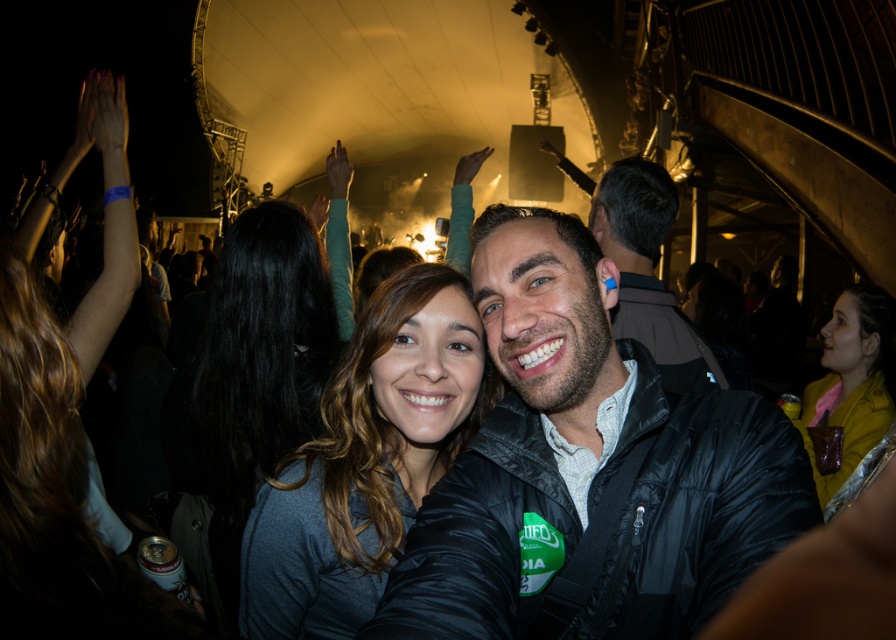
Does dark gray sweater at center come in front of yellow leather jacket at center?

No.

Between dark gray sweater at center and yellow leather jacket at center, which one is positioned higher?

dark gray sweater at center is above.

Where is `dark gray sweater at center`? The width and height of the screenshot is (896, 640). dark gray sweater at center is located at coordinates (246, 388).

The image size is (896, 640). In order to click on dark gray sweater at center in this screenshot , I will do (x=246, y=388).

Who is positioned more to the right, black leather jacket at center or dark gray fabric at center?

black leather jacket at center

Does black leather jacket at center appear on the right side of dark gray fabric at center?

Yes, black leather jacket at center is to the right of dark gray fabric at center.

Describe the element at coordinates (589, 472) in the screenshot. Image resolution: width=896 pixels, height=640 pixels. I see `black leather jacket at center` at that location.

Where is `black leather jacket at center`? black leather jacket at center is located at coordinates (589, 472).

Does dark gray sweater at center appear under dark blue jacket at center?

Correct, dark gray sweater at center is located below dark blue jacket at center.

Who is more forward, (222, 436) or (669, 385)?

Point (669, 385)

Where is `dark gray sweater at center`? Image resolution: width=896 pixels, height=640 pixels. dark gray sweater at center is located at coordinates (246, 388).

Where is `dark gray sweater at center`? The image size is (896, 640). dark gray sweater at center is located at coordinates (246, 388).